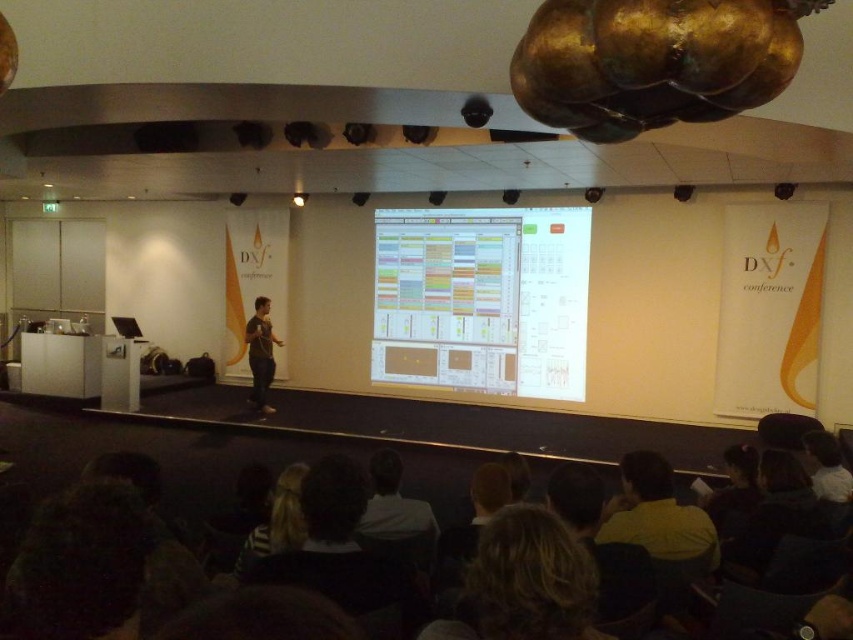
Question: Does white glossy projection screen at center appear on the right side of yellow matte shirt at lower center?

Choices:
 (A) no
 (B) yes

Answer: (A)

Question: Is white glossy projection screen at center bigger than yellow matte shirt at lower center?

Choices:
 (A) yes
 (B) no

Answer: (A)

Question: Does yellow matte shirt at lower center lie behind striped fabric hair at lower center?

Choices:
 (A) yes
 (B) no

Answer: (B)

Question: Which object is farther from the camera taking this photo?

Choices:
 (A) striped fabric hair at lower center
 (B) white glossy projection screen at center

Answer: (B)

Question: Estimate the real-world distances between objects in this image. Which object is closer to the white glossy projection screen at center?

Choices:
 (A) striped fabric hair at lower center
 (B) yellow matte shirt at lower center
 (C) white shirt at center

Answer: (C)

Question: Among these objects, which one is farthest from the camera?

Choices:
 (A) yellow matte shirt at lower center
 (B) striped fabric hair at lower center

Answer: (B)